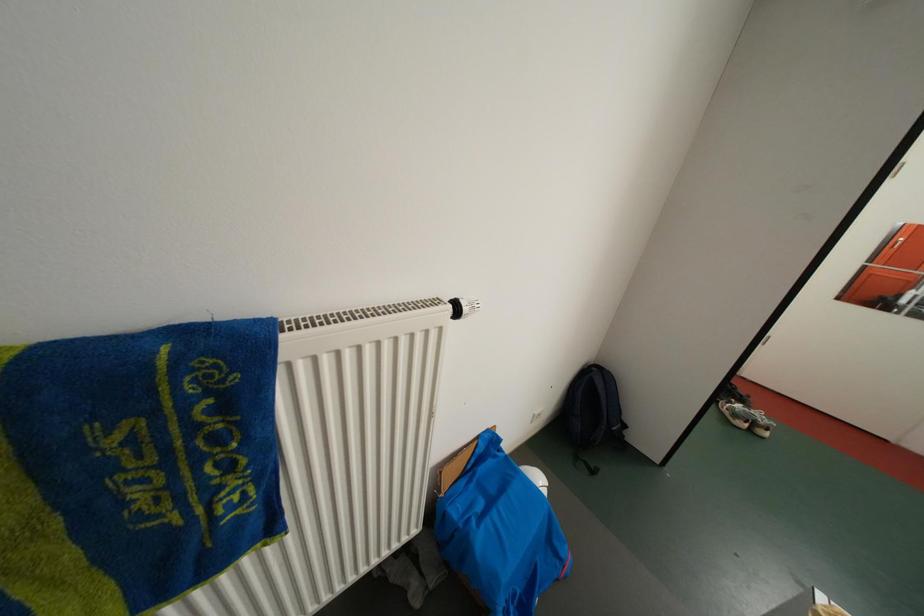
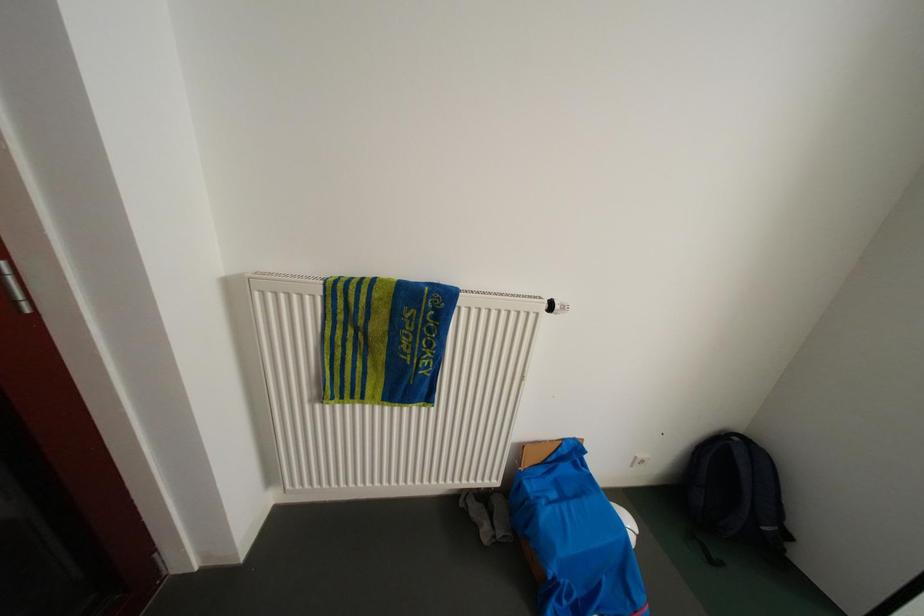
Question: The camera is either moving clockwise (left) or counter-clockwise (right) around the object. The first image is from the beginning of the video and the second image is from the end. Is the camera moving left or right when shooting the video?

Choices:
 (A) Left
 (B) Right

Answer: (B)